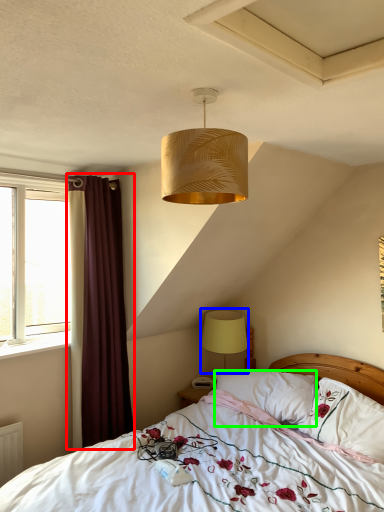
Question: Estimate the real-world distances between objects in this image. Which object is farther from curtain (highlighted by a red box), lamp (highlighted by a blue box) or pillow (highlighted by a green box)?

Choices:
 (A) lamp
 (B) pillow

Answer: (B)